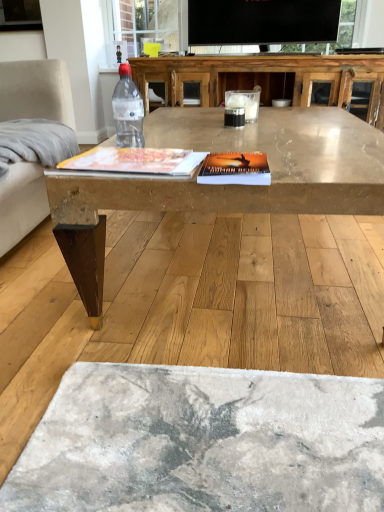
Question: Considering the relative positions of light gray fabric armchair at left and transparent plastic bottle at center in the image provided, is light gray fabric armchair at left to the right of transparent plastic bottle at center from the viewer's perspective?

Choices:
 (A) no
 (B) yes

Answer: (A)

Question: Is light gray fabric armchair at left facing towards transparent plastic bottle at center?

Choices:
 (A) yes
 (B) no

Answer: (B)

Question: Considering the relative positions of light gray fabric armchair at left and transparent plastic bottle at center in the image provided, is light gray fabric armchair at left in front of transparent plastic bottle at center?

Choices:
 (A) yes
 (B) no

Answer: (B)

Question: Can transparent plastic bottle at center be found inside light gray fabric armchair at left?

Choices:
 (A) no
 (B) yes

Answer: (A)

Question: Is light gray fabric armchair at left not within transparent plastic bottle at center?

Choices:
 (A) no
 (B) yes

Answer: (B)

Question: Choose the correct answer: Is matte wooden coffee table at center inside clear glass table at center or outside it?

Choices:
 (A) inside
 (B) outside

Answer: (B)

Question: In terms of size, does matte wooden coffee table at center appear bigger or smaller than clear glass table at center?

Choices:
 (A) small
 (B) big

Answer: (B)

Question: Considering the relative positions of matte wooden coffee table at center and clear glass table at center in the image provided, is matte wooden coffee table at center to the left or to the right of clear glass table at center?

Choices:
 (A) right
 (B) left

Answer: (B)

Question: From the image's perspective, relative to clear glass table at center, is matte wooden coffee table at center above or below?

Choices:
 (A) above
 (B) below

Answer: (B)

Question: Choose the correct answer: Is transparent plastic bottle at center inside matte wooden coffee table at center or outside it?

Choices:
 (A) inside
 (B) outside

Answer: (B)

Question: Considering the positions of transparent plastic bottle at center and matte wooden coffee table at center in the image, is transparent plastic bottle at center taller or shorter than matte wooden coffee table at center?

Choices:
 (A) tall
 (B) short

Answer: (B)

Question: From the image's perspective, relative to matte wooden coffee table at center, is transparent plastic bottle at center above or below?

Choices:
 (A) below
 (B) above

Answer: (B)

Question: Looking at their shapes, would you say transparent plastic bottle at center is wider or thinner than matte wooden coffee table at center?

Choices:
 (A) thin
 (B) wide

Answer: (A)

Question: From a real-world perspective, is light gray fabric armchair at left positioned above or below clear glass table at center?

Choices:
 (A) below
 (B) above

Answer: (A)

Question: In terms of height, does light gray fabric armchair at left look taller or shorter compared to clear glass table at center?

Choices:
 (A) tall
 (B) short

Answer: (B)